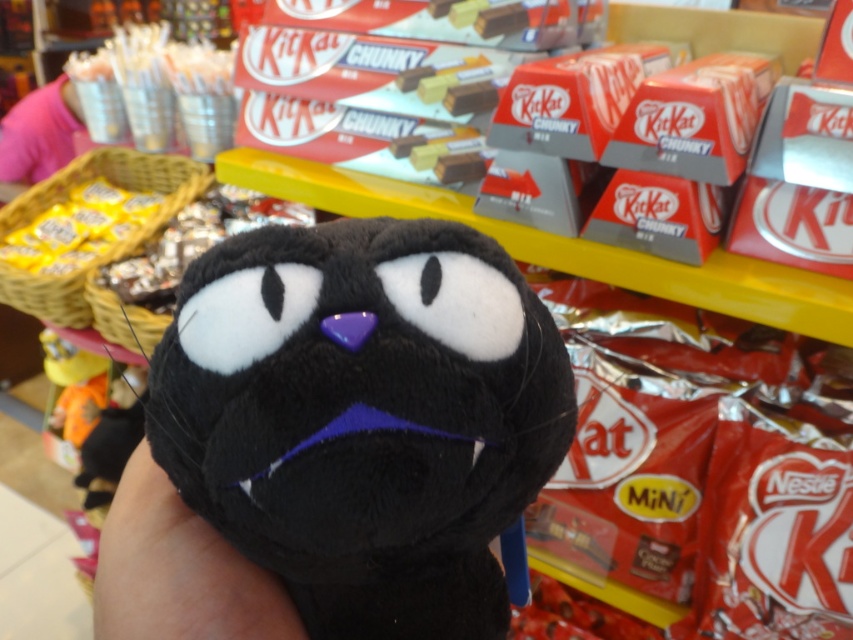
You are a customer at a store and you see the soft plush toy at center and the soft skin at center. Which one is bigger in size?

The soft plush toy at center is larger in size compared to the soft skin at center.

You are a customer in a store holding the soft skin at center and looking at the soft plush toy at center. Which item is located to the right of your hand?

The soft plush toy at center is positioned on the right side of the soft skin at center, so it is located to the right of your hand.